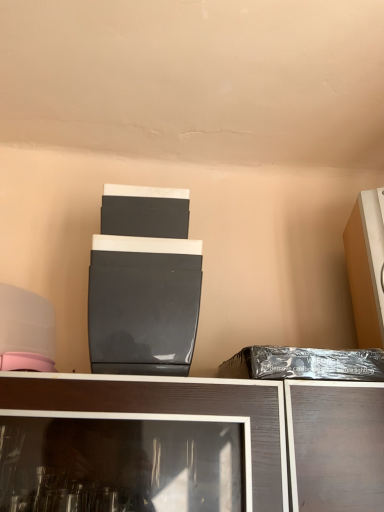
Question: Can you confirm if matte black appliance at center, which is counted as the second appliance, starting from the right, is positioned to the left of black plastic bag at right?

Choices:
 (A) yes
 (B) no

Answer: (A)

Question: Does matte black appliance at center, which is counted as the second appliance, starting from the right, have a smaller size compared to black plastic bag at right?

Choices:
 (A) no
 (B) yes

Answer: (A)

Question: Can we say matte black appliance at center, which is counted as the second appliance, starting from the right, lies outside black plastic bag at right?

Choices:
 (A) yes
 (B) no

Answer: (A)

Question: Is matte black appliance at center, arranged as the 1th appliance when viewed from the left, closer to the viewer compared to black plastic bag at right?

Choices:
 (A) yes
 (B) no

Answer: (A)

Question: Does matte black appliance at center, which is counted as the second appliance, starting from the right, touch black plastic bag at right?

Choices:
 (A) no
 (B) yes

Answer: (A)

Question: Is matte orange cabinet at right, the 2th appliance positioned from the left, bigger or smaller than matte black appliance at center, arranged as the 1th appliance when viewed from the left?

Choices:
 (A) small
 (B) big

Answer: (A)

Question: Do you think matte orange cabinet at right, the 2th appliance positioned from the left, is within matte black appliance at center, arranged as the 1th appliance when viewed from the left, or outside of it?

Choices:
 (A) outside
 (B) inside

Answer: (A)

Question: Relative to matte black appliance at center, arranged as the 1th appliance when viewed from the left, is matte orange cabinet at right, which ranks as the first appliance in right-to-left order, in front or behind?

Choices:
 (A) front
 (B) behind

Answer: (B)

Question: Is matte orange cabinet at right, which ranks as the first appliance in right-to-left order, wider or thinner than matte black appliance at center, arranged as the 1th appliance when viewed from the left?

Choices:
 (A) thin
 (B) wide

Answer: (A)

Question: Is matte black appliance at center, arranged as the 1th appliance when viewed from the left, to the left or to the right of black plastic bag at right in the image?

Choices:
 (A) left
 (B) right

Answer: (A)

Question: Looking at their shapes, would you say matte black appliance at center, which is counted as the second appliance, starting from the right, is wider or thinner than black plastic bag at right?

Choices:
 (A) wide
 (B) thin

Answer: (A)

Question: Is matte black appliance at center, which is counted as the second appliance, starting from the right, inside or outside of black plastic bag at right?

Choices:
 (A) outside
 (B) inside

Answer: (A)

Question: Is point (190, 291) closer or farther from the camera than point (365, 367)?

Choices:
 (A) farther
 (B) closer

Answer: (A)

Question: In terms of height, does matte black appliance at center, which is counted as the second appliance, starting from the right, look taller or shorter compared to matte orange cabinet at right, the 2th appliance positioned from the left?

Choices:
 (A) short
 (B) tall

Answer: (A)

Question: Is matte black appliance at center, arranged as the 1th appliance when viewed from the left, bigger or smaller than matte orange cabinet at right, which ranks as the first appliance in right-to-left order?

Choices:
 (A) small
 (B) big

Answer: (B)